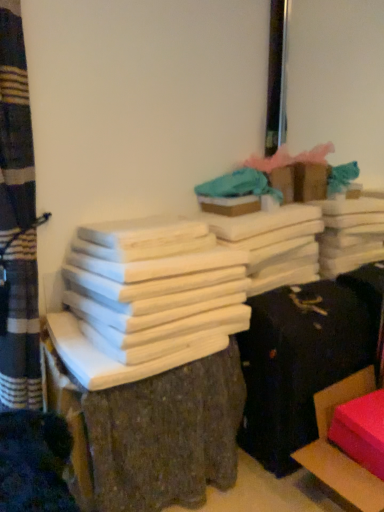
Question: Are smooth wood stack at center, acting as the 2th furniture starting from the right, and white matte wood at center located far from each other?

Choices:
 (A) no
 (B) yes

Answer: (A)

Question: From the image's perspective, is smooth wood stack at center, acting as the 2th furniture starting from the right, over white matte wood at center?

Choices:
 (A) no
 (B) yes

Answer: (A)

Question: Is smooth wood stack at center, marked as the 1th furniture in a left-to-right arrangement, not within white matte wood at center?

Choices:
 (A) yes
 (B) no

Answer: (A)

Question: From a real-world perspective, is smooth wood stack at center, marked as the 1th furniture in a left-to-right arrangement, physically above white matte wood at center?

Choices:
 (A) yes
 (B) no

Answer: (B)

Question: Is smooth wood stack at center, acting as the 2th furniture starting from the right, shorter than white matte wood at center?

Choices:
 (A) yes
 (B) no

Answer: (B)

Question: Is rubberized pink cushion at lower right, arranged as the first furniture when viewed from the right, taller or shorter than teal fabric at upper center?

Choices:
 (A) short
 (B) tall

Answer: (B)

Question: From a real-world perspective, is rubberized pink cushion at lower right, the 2th furniture in the left-to-right sequence, above or below teal fabric at upper center?

Choices:
 (A) below
 (B) above

Answer: (A)

Question: From the image's perspective, relative to teal fabric at upper center, is rubberized pink cushion at lower right, arranged as the first furniture when viewed from the right, above or below?

Choices:
 (A) below
 (B) above

Answer: (A)

Question: Considering the positions of rubberized pink cushion at lower right, the 2th furniture in the left-to-right sequence, and teal fabric at upper center in the image, is rubberized pink cushion at lower right, the 2th furniture in the left-to-right sequence, wider or thinner than teal fabric at upper center?

Choices:
 (A) thin
 (B) wide

Answer: (B)

Question: Is teal fabric at upper center taller or shorter than smooth wood stack at center, marked as the 1th furniture in a left-to-right arrangement?

Choices:
 (A) short
 (B) tall

Answer: (A)

Question: From the image's perspective, relative to smooth wood stack at center, acting as the 2th furniture starting from the right, is teal fabric at upper center above or below?

Choices:
 (A) below
 (B) above

Answer: (B)

Question: Considering the relative positions of teal fabric at upper center and smooth wood stack at center, marked as the 1th furniture in a left-to-right arrangement, in the image provided, is teal fabric at upper center to the left or to the right of smooth wood stack at center, marked as the 1th furniture in a left-to-right arrangement,?

Choices:
 (A) right
 (B) left

Answer: (A)

Question: From a real-world perspective, is teal fabric at upper center physically located above or below smooth wood stack at center, acting as the 2th furniture starting from the right?

Choices:
 (A) above
 (B) below

Answer: (A)

Question: Is point pos(296,459) closer or farther from the camera than point pos(150,484)?

Choices:
 (A) closer
 (B) farther

Answer: (B)

Question: From their relative heights in the image, would you say rubberized pink cushion at lower right, the 2th furniture in the left-to-right sequence, is taller or shorter than smooth wood stack at center, marked as the 1th furniture in a left-to-right arrangement?

Choices:
 (A) tall
 (B) short

Answer: (B)